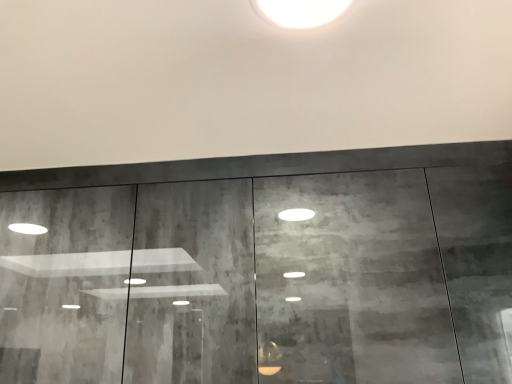
Question: In terms of size, does textured concrete door at center appear bigger or smaller than white glossy light at upper center?

Choices:
 (A) small
 (B) big

Answer: (B)

Question: In terms of height, does textured concrete door at center look taller or shorter compared to white glossy light at upper center?

Choices:
 (A) tall
 (B) short

Answer: (A)

Question: Considering the positions of textured concrete door at center and white glossy light at upper center in the image, is textured concrete door at center wider or thinner than white glossy light at upper center?

Choices:
 (A) thin
 (B) wide

Answer: (B)

Question: Considering the positions of point (305, 23) and point (478, 150), is point (305, 23) closer or farther from the camera than point (478, 150)?

Choices:
 (A) farther
 (B) closer

Answer: (B)

Question: From a real-world perspective, is white glossy light at upper center physically located above or below textured concrete door at center?

Choices:
 (A) above
 (B) below

Answer: (A)

Question: Would you say white glossy light at upper center is inside or outside textured concrete door at center?

Choices:
 (A) inside
 (B) outside

Answer: (B)

Question: Considering the positions of white glossy light at upper center and textured concrete door at center in the image, is white glossy light at upper center bigger or smaller than textured concrete door at center?

Choices:
 (A) small
 (B) big

Answer: (A)